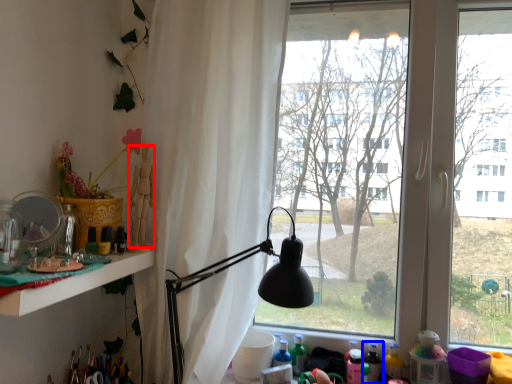
Question: Which point is closer to the camera, person (highlighted by a red box) or bottle (highlighted by a blue box)?

Choices:
 (A) person
 (B) bottle

Answer: (A)